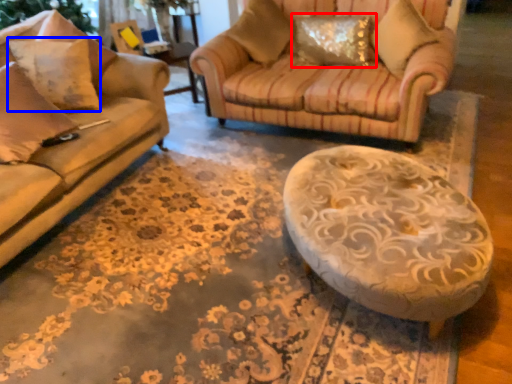
Question: Which object is closer to the camera taking this photo, pillow (highlighted by a red box) or pillow (highlighted by a blue box)?

Choices:
 (A) pillow
 (B) pillow

Answer: (B)